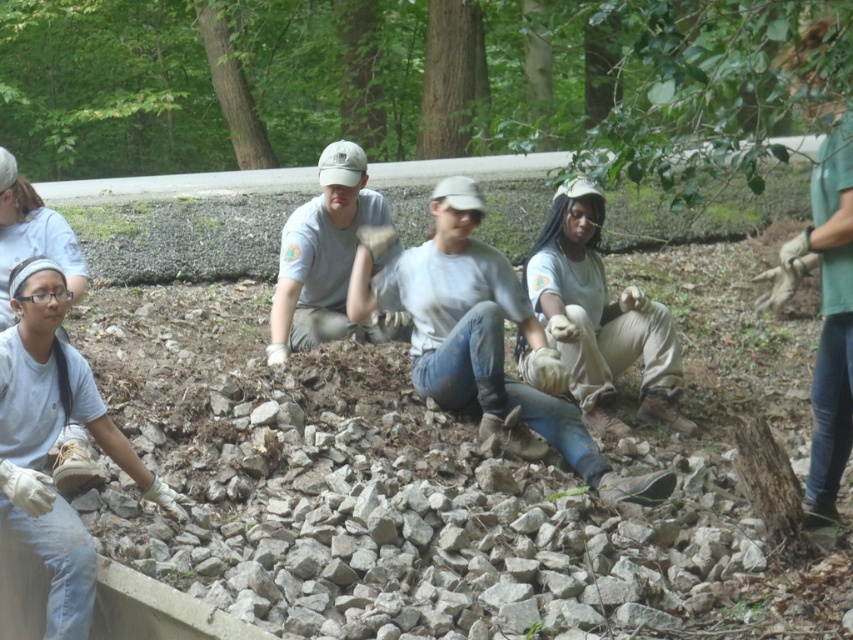
Question: Estimate the real-world distances between objects in this image. Which object is closer to the white cotton shirt at center?

Choices:
 (A) matte gray shirt at center
 (B) light brown fabric gloves at center

Answer: (B)

Question: Is light brown fabric gloves at center to the left of matte gray shirt at center from the viewer's perspective?

Choices:
 (A) no
 (B) yes

Answer: (A)

Question: Can you confirm if light brown fabric gloves at center is smaller than matte gray shirt at center?

Choices:
 (A) yes
 (B) no

Answer: (B)

Question: Which point is farther from the camera taking this photo?

Choices:
 (A) (567, 422)
 (B) (631, 317)
 (C) (282, 278)

Answer: (C)

Question: Does white cotton shirt at center have a lesser width compared to matte gray shirt at center?

Choices:
 (A) no
 (B) yes

Answer: (A)

Question: Which point is closer to the camera?

Choices:
 (A) white cotton shirt at center
 (B) light brown fabric gloves at center

Answer: (A)